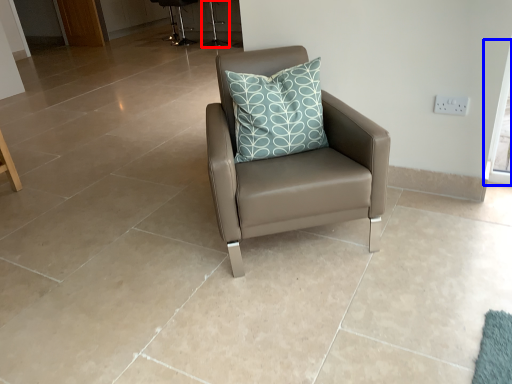
Question: Which object is further to the camera taking this photo, bar stool (highlighted by a red box) or window screen (highlighted by a blue box)?

Choices:
 (A) bar stool
 (B) window screen

Answer: (A)